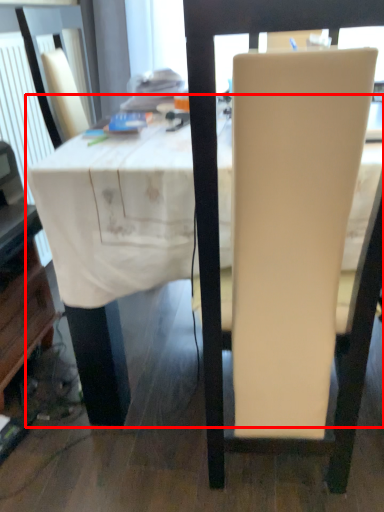
Question: Considering the relative positions of table (annotated by the red box) and chair in the image provided, where is table (annotated by the red box) located with respect to the staircase?

Choices:
 (A) right
 (B) left

Answer: (A)